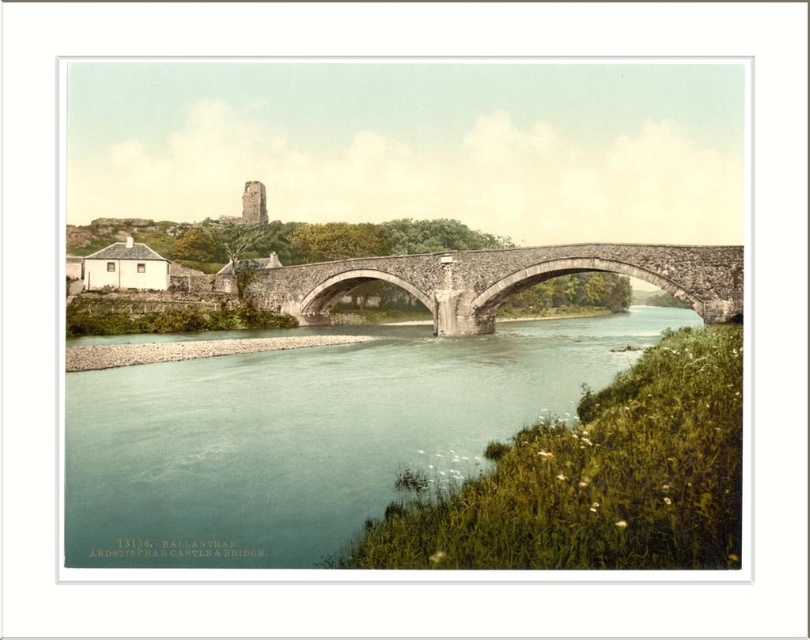
Question: Is greenish-blue water at center smaller than stone bridge at center?

Choices:
 (A) no
 (B) yes

Answer: (A)

Question: Which point is farther to the camera?

Choices:
 (A) greenish-blue water at center
 (B) stone bridge at center

Answer: (B)

Question: Which of the following is the closest to the observer?

Choices:
 (A) stone bridge at center
 (B) greenish-blue water at center

Answer: (B)

Question: Does greenish-blue water at center appear over stone bridge at center?

Choices:
 (A) no
 (B) yes

Answer: (A)

Question: Which point is farther to the camera?

Choices:
 (A) (727, 256)
 (B) (470, 445)

Answer: (A)

Question: Does greenish-blue water at center appear under stone bridge at center?

Choices:
 (A) yes
 (B) no

Answer: (A)